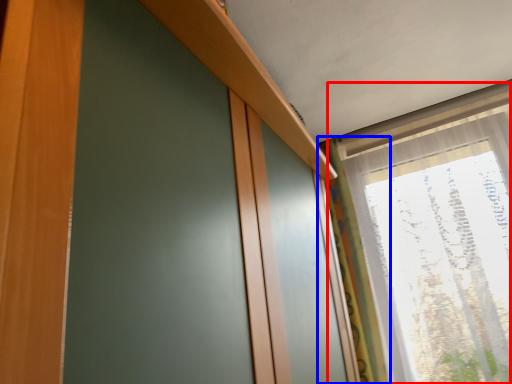
Question: Which object appears closest to the camera in this image, window (highlighted by a red box) or curtain (highlighted by a blue box)?

Choices:
 (A) window
 (B) curtain

Answer: (A)